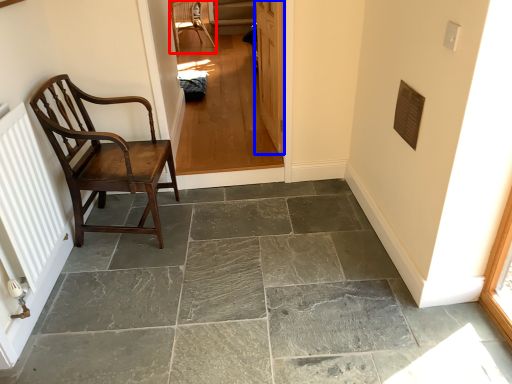
Question: Among these objects, which one is nearest to the camera, chair (highlighted by a red box) or door (highlighted by a blue box)?

Choices:
 (A) chair
 (B) door

Answer: (B)